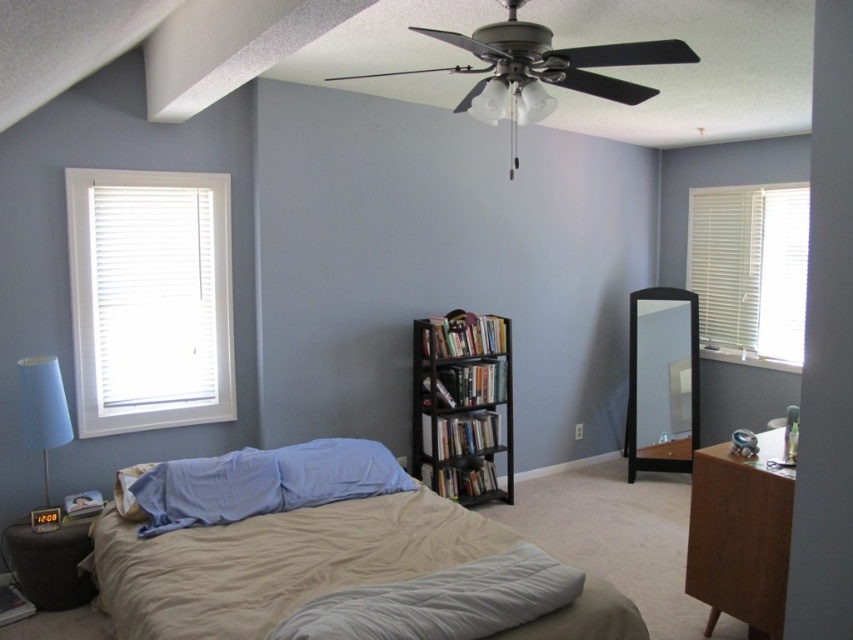
You are standing in the bedroom and want to locate the matte blue lampshade at left and the white glass ceiling fan at upper center. Which object is positioned to the left of the other?

The matte blue lampshade at left is to the left of the white glass ceiling fan at upper center.

You are trying to hang a wide poster that is 1.5 meters wide on the wall. You can choose between placing it above the white matte window at left or above the brown wooden dresser at right. Based on their widths, which location would you recommend?

The white matte window at left is wider than the brown wooden dresser at right, so placing the poster above the white matte window at left would provide enough space for the 1.5 meter wide poster.

You are standing in the bedroom and want to know how far the point marked at coordinates (202, 205) is from your current position. Can you determine the distance?

The point marked at coordinates (202, 205) is 3.60 meters away from your current position.